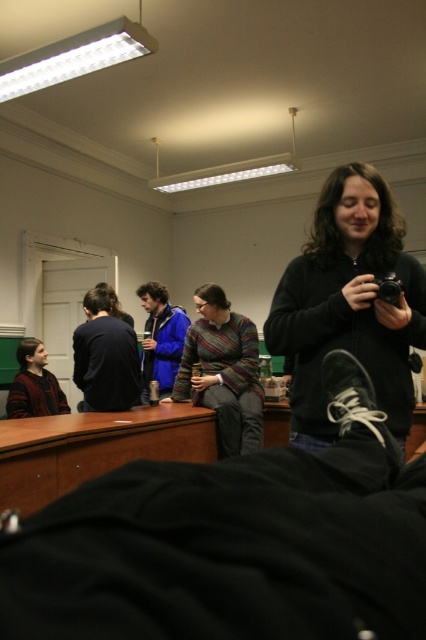
Question: Does black matte sweater at center appear on the left side of striped sweater at center?

Choices:
 (A) no
 (B) yes

Answer: (A)

Question: Considering the real-world distances, which object is farthest from the dark blue sweater at left?

Choices:
 (A) blue fleece jacket at center
 (B) striped sweater at center
 (C) knitted sweater at lower left

Answer: (C)

Question: Is blue fleece jacket at center positioned in front of knitted sweater at lower left?

Choices:
 (A) no
 (B) yes

Answer: (A)

Question: Considering the real-world distances, which object is farthest from the blue fleece jacket at center?

Choices:
 (A) black matte sweater at center
 (B) dark blue sweater at left

Answer: (A)

Question: Is black matte sweater at center further to the viewer compared to dark blue sweater at left?

Choices:
 (A) no
 (B) yes

Answer: (A)

Question: Which of the following is the closest to the observer?

Choices:
 (A) (175, 365)
 (B) (363, 312)
 (C) (117, 349)
 (D) (204, 365)

Answer: (B)